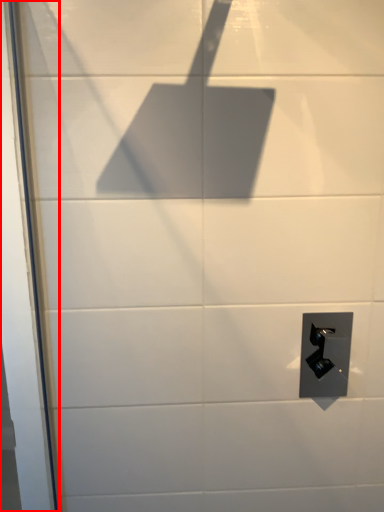
Question: In this image, where is screen door (annotated by the red box) located relative to door handle?

Choices:
 (A) left
 (B) right

Answer: (A)